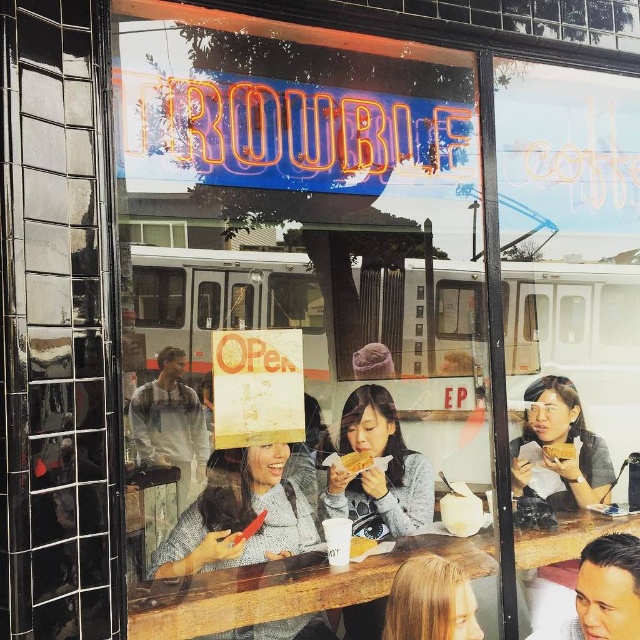
You are a photographer standing at the entrance of the Trouble cafe. You want to take a closeup photo of the matte white bread at center from the camera. Can you do it without moving the bread?

The matte white bread at center and camera are 1.69 meters apart, so yes, you can take a closeup photo of the matte white bread at center from the camera without moving the bread since the distance is manageable for a closeup shot.

What is located at the point with coordinates (355, 461) in the image?

The point at coordinates (355, 461) indicates matte white bread at center.